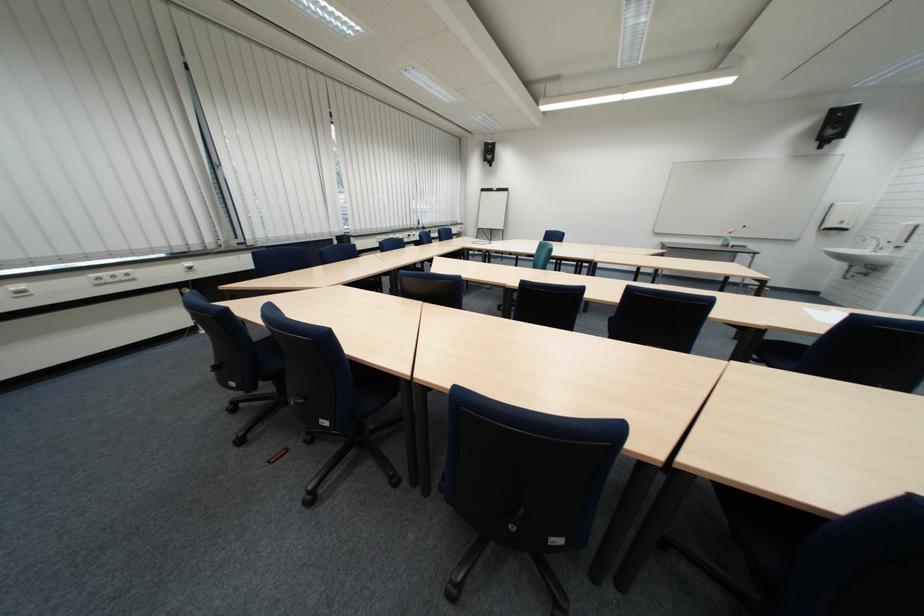
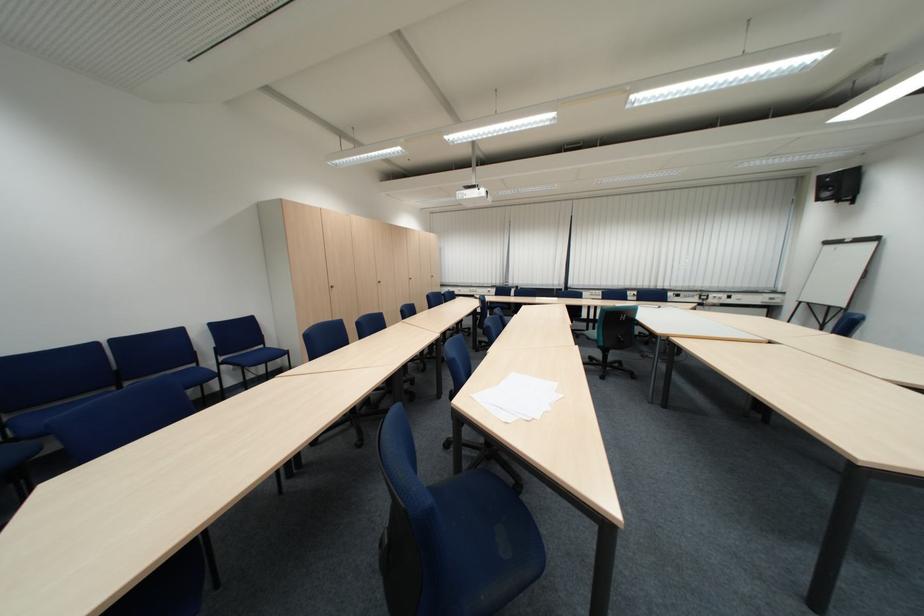
Where in the second image is the point corresponding to point (338, 232) from the first image?

(564, 284)